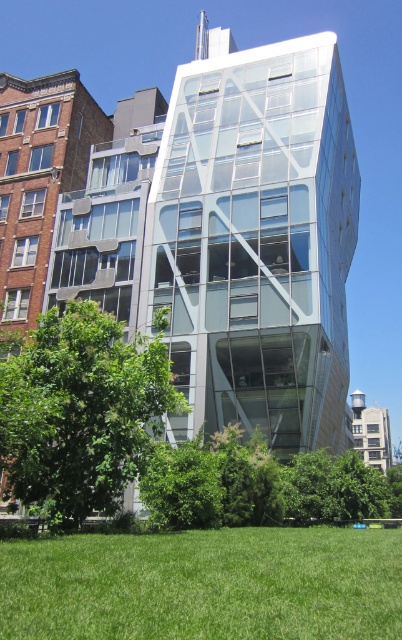
You are standing in front of the modern architectural structure and notice the green grass at lower center and the green leafy tree at lower left. Which of these two objects has a smaller width?

The green grass at lower center is thinner than the green leafy tree at lower left, so the green grass at lower center has a smaller width.

You are standing at the center of the image and want to locate the green leafy tree at lower left. Which direction should you face to see it?

The green leafy tree at lower left is located at coordinates point (79,412), so you should face the lower left direction to see it.